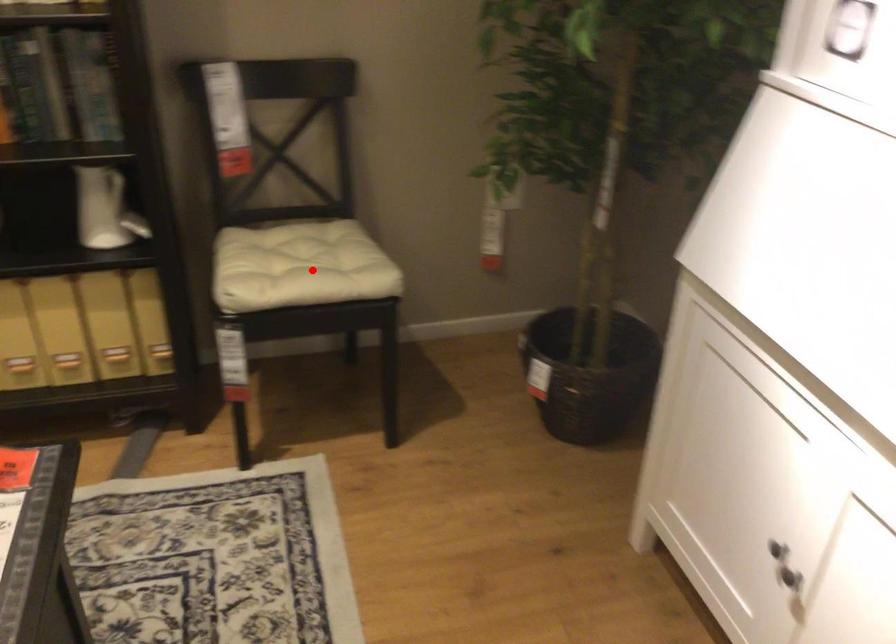
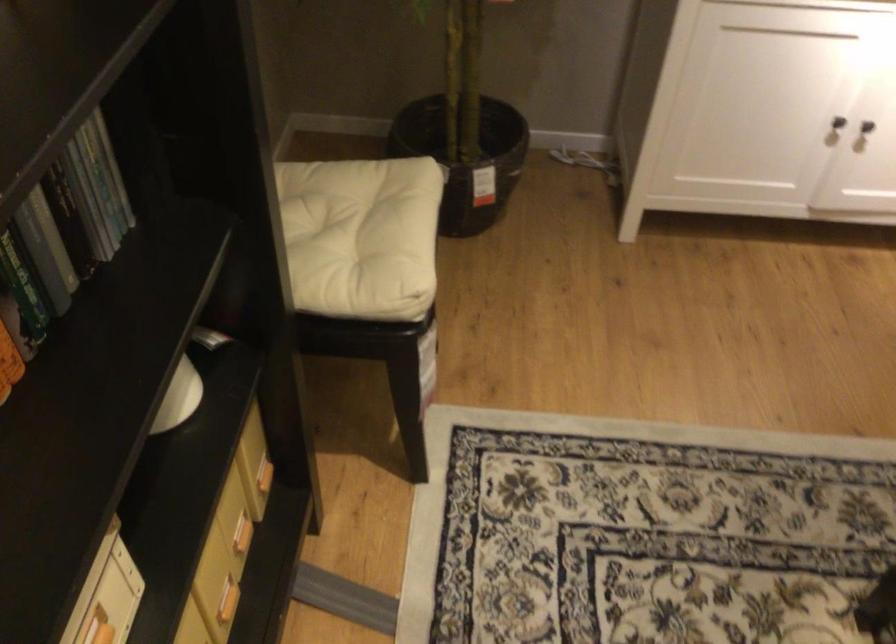
Question: A red point is marked in image1. In image2, is the corresponding 3D point closer to the camera or farther? Reply with the corresponding letter.

Choices:
 (A) The corresponding 3D point is closer.
 (B) The corresponding 3D point is farther.

Answer: (A)